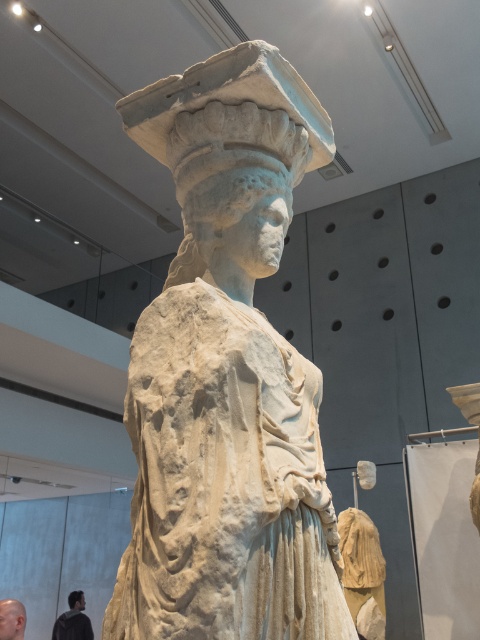
Does white marble head at center have a smaller size compared to bald skin at lower left?

Incorrect, white marble head at center is not smaller in size than bald skin at lower left.

You are a GUI agent. You are given a task and a screenshot of the screen. Output one action in this format:
    pyautogui.click(x=<x>, y=<y>)
    Task: Click on the white marble head at center
    Image resolution: width=480 pixels, height=640 pixels.
    Given the screenshot: What is the action you would take?
    pyautogui.click(x=224, y=209)

Who is more forward, (211, 250) or (13, 616)?

Point (211, 250)

The height and width of the screenshot is (640, 480). I want to click on white marble head at center, so click(224, 209).

Does white marble statue at center appear on the right side of matte gray stone head at center?

Indeed, white marble statue at center is positioned on the right side of matte gray stone head at center.

Which is in front, point (265, 536) or point (72, 593)?

Point (265, 536)

The width and height of the screenshot is (480, 640). Identify the location of white marble statue at center. (227, 376).

I want to click on white marble statue at center, so click(227, 376).

How distant is dark brown leather jacket at lower left from bald skin at lower left?

The distance of dark brown leather jacket at lower left from bald skin at lower left is 10.76 feet.

Which is in front, point (79, 634) or point (4, 625)?

Point (4, 625) is more forward.

Is point (59, 620) less distant than point (15, 611)?

No.

Where is `dark brown leather jacket at lower left`? This screenshot has width=480, height=640. dark brown leather jacket at lower left is located at coordinates (72, 620).